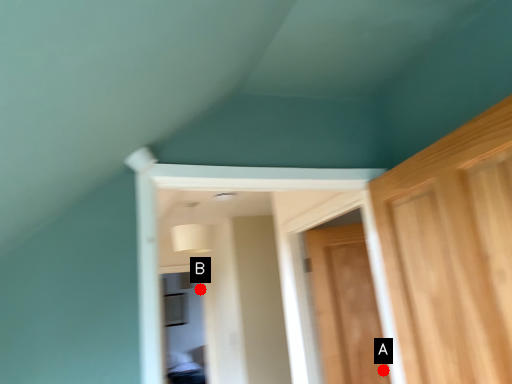
Question: Two points are circled on the image, labeled by A and B beside each circle. Which point is farther from the camera taking this photo?

Choices:
 (A) A is further
 (B) B is further

Answer: (B)